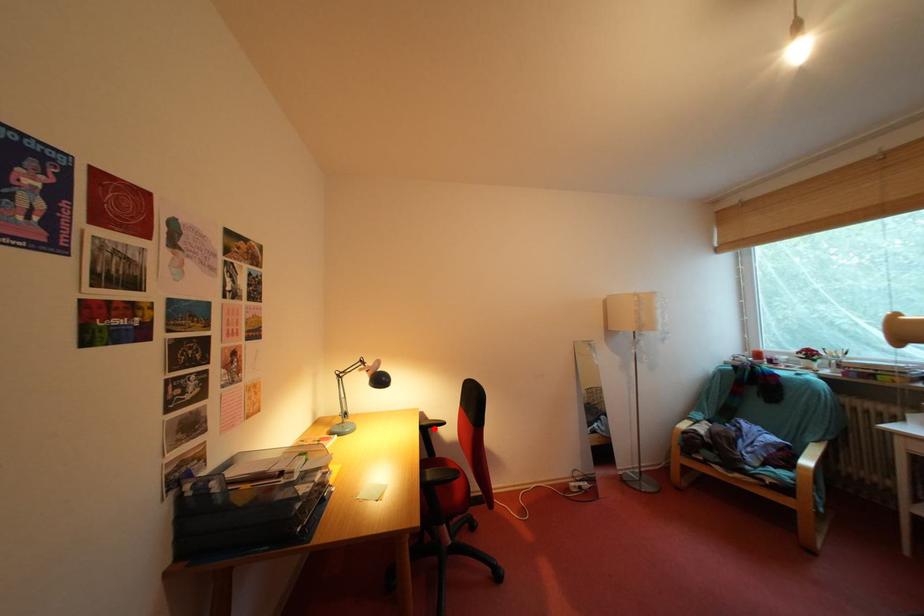
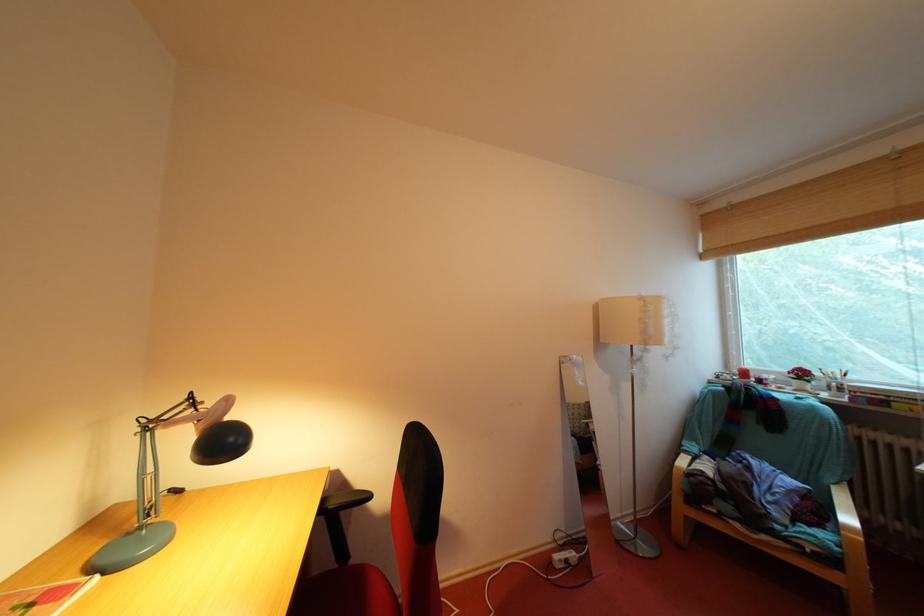
The point at the highlighted location is marked in the first image. Where is the corresponding point in the second image?

(342, 508)